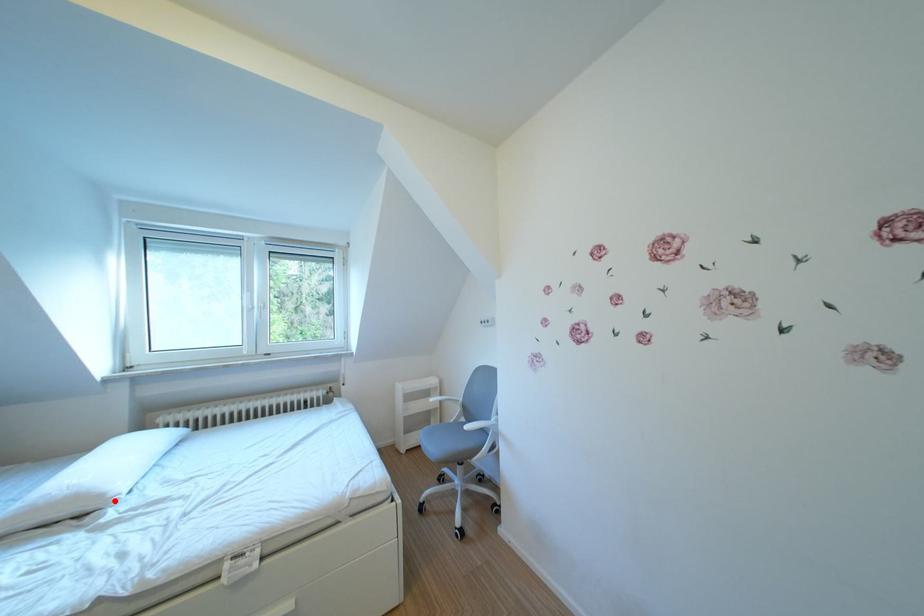
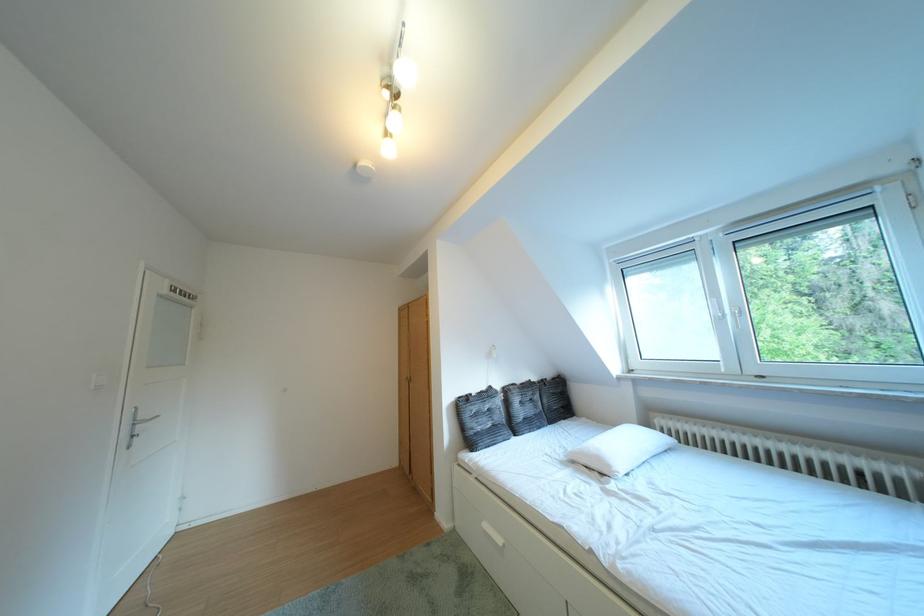
Question: I am providing you with two images of the same scene from different viewpoints. Given a red point in image1, look at the same physical point in image2. Is it:

Choices:
 (A) Closer to the viewpoint
 (B) Farther from the viewpoint

Answer: (B)